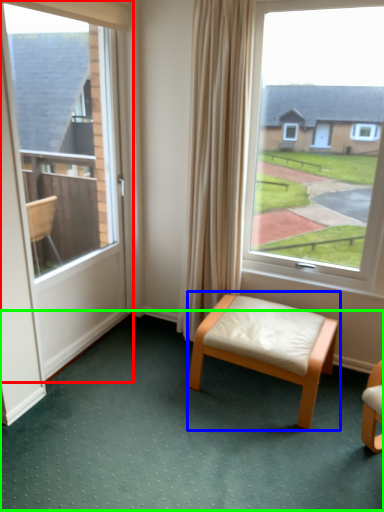
Question: Which is farther away from door (highlighted by a red box)? stool (highlighted by a blue box) or golf course (highlighted by a green box)?

Choices:
 (A) stool
 (B) golf course

Answer: (A)